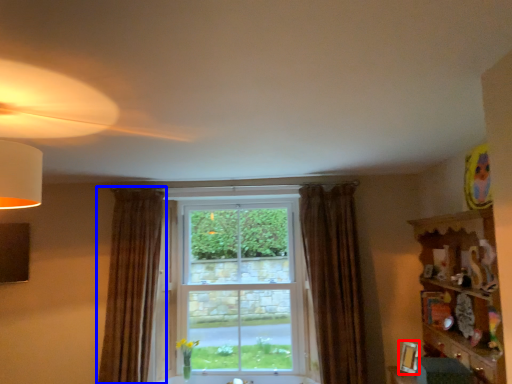
Question: Which object appears closest to the camera in this image, picture frame (highlighted by a red box) or curtain (highlighted by a blue box)?

Choices:
 (A) picture frame
 (B) curtain

Answer: (A)